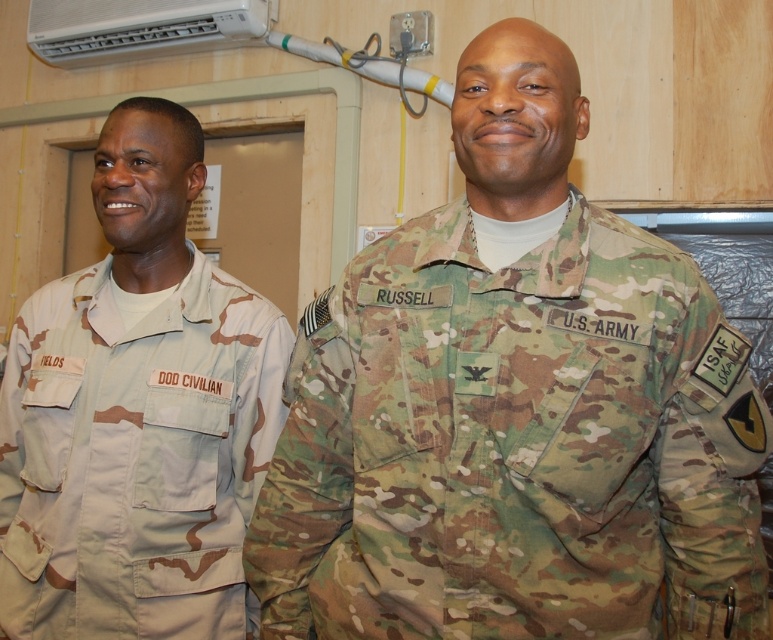
You are a photographer planning to take a group photo of the two military personnel. Since the tan camouflage uniform at left and the white plastic air conditioner at upper center are in the frame, which object is narrower in the image?

Result: The tan camouflage uniform at left is narrower than the white plastic air conditioner at upper center in the image.

You are a photographer standing 3 feet away from the camo fabric us army uniform at center. Can you comfortably take a full body photo of it without moving closer than your current position?

The distance of camo fabric us army uniform at center from viewer is 35.97 inches, which is approximately 3 feet. Since you are already at this distance, you can comfortably take a full body photo without needing to move closer.